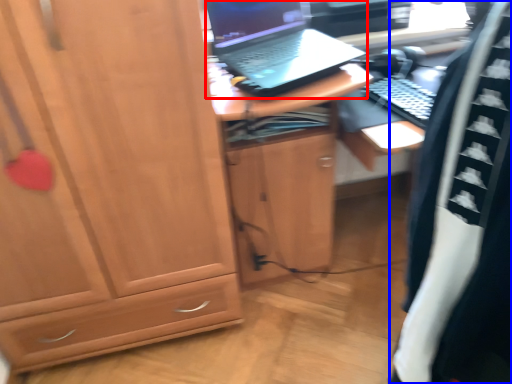
Question: Among these objects, which one is farthest to the camera, laptop (highlighted by a red box) or clothing (highlighted by a blue box)?

Choices:
 (A) laptop
 (B) clothing

Answer: (A)